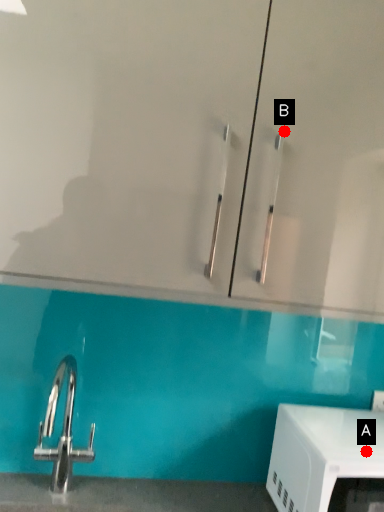
Question: Two points are circled on the image, labeled by A and B beside each circle. Which point is farther from the camera taking this photo?

Choices:
 (A) A is further
 (B) B is further

Answer: (A)